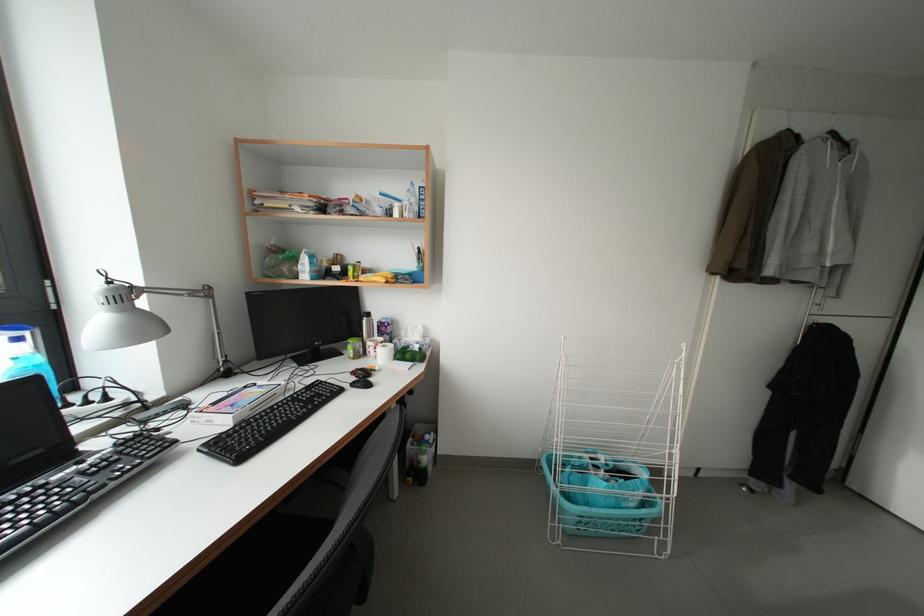
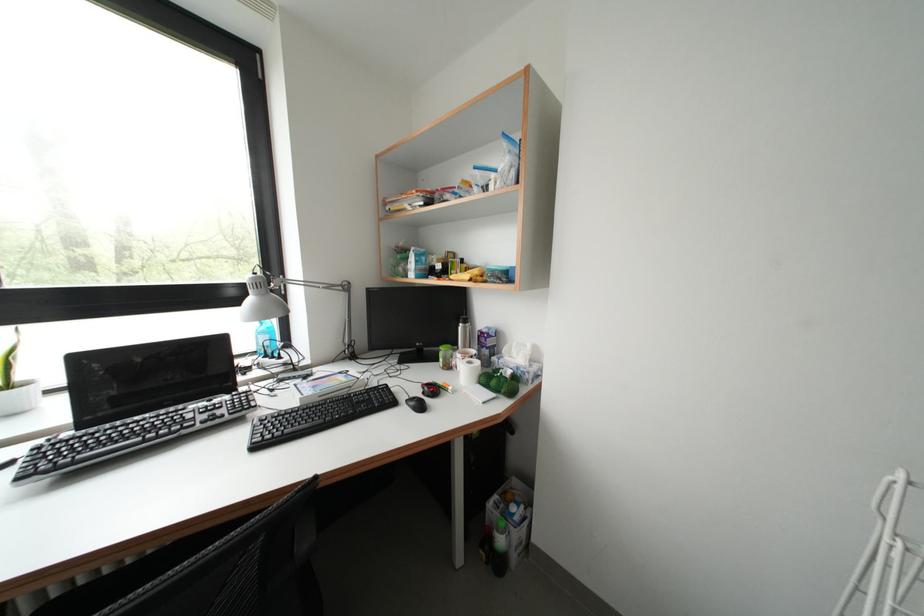
Find the pixel in the second image that matches pixel 371 326 in the first image.

(467, 333)